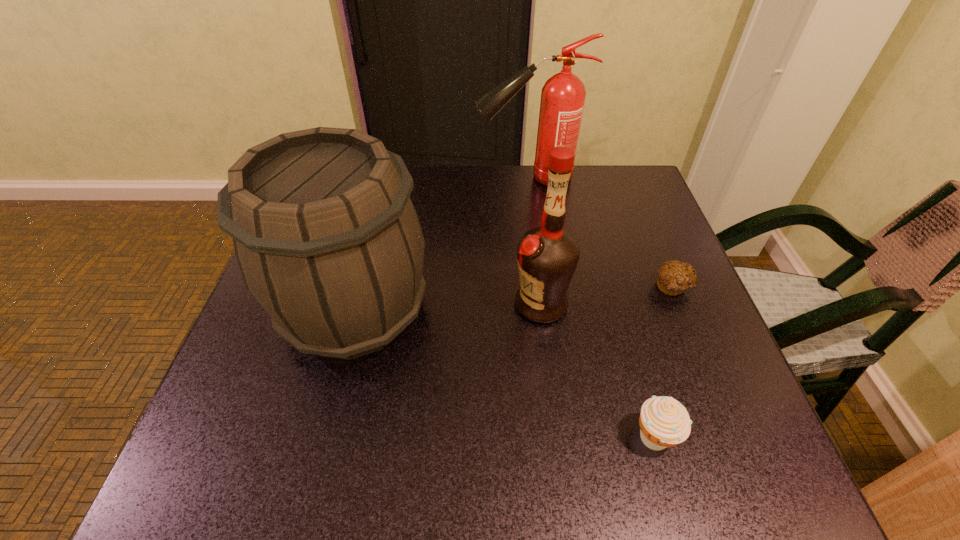
You are a GUI agent. You are given a task and a screenshot of the screen. Output one action in this format:
    pyautogui.click(x=<x>, y=<y>)
    Task: Click on the fire extinguisher
    
    Given the screenshot: What is the action you would take?
    pyautogui.click(x=563, y=96)

Locate an element on the screen. Image resolution: width=960 pixels, height=540 pixels. liquor is located at coordinates (547, 256).

This screenshot has height=540, width=960. Identify the location of wine bucket. (327, 239).

Find the location of a particular element. the nearest object is located at coordinates (664, 422).

Locate an element on the screen. This screenshot has width=960, height=540. the nearer muffin is located at coordinates (664, 422).

Where is `the farther muffin`? This screenshot has height=540, width=960. the farther muffin is located at coordinates (675, 277).

Locate an element on the screen. the shortest object is located at coordinates (675, 277).

Locate an element on the screen. free region located at the nozzle end of the farthest object is located at coordinates (432, 178).

Find the location of `vacant space located at the nozzle end of the farthest object`. vacant space located at the nozzle end of the farthest object is located at coordinates (436, 178).

The width and height of the screenshot is (960, 540). In order to click on free location located 0.300m at the nozzle end of the farthest object in this screenshot , I will do `click(368, 178)`.